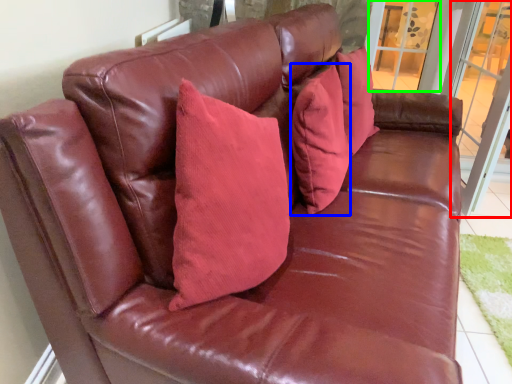
Question: Which object is positioned farthest from screen door (highlighted by a red box)? Select from pillow (highlighted by a blue box) and window (highlighted by a green box).

Choices:
 (A) pillow
 (B) window

Answer: (A)